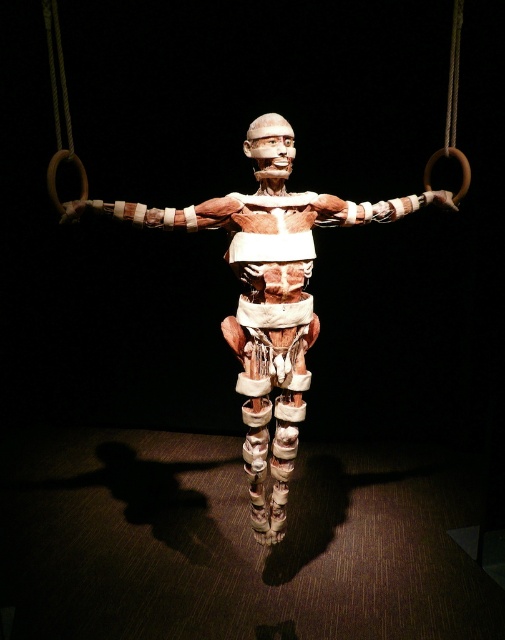
Is matte brown anatomical model at center smaller than wooden rings at upper center?

No.

Which is in front, point (270, 348) or point (453, 140)?

Point (270, 348) is more forward.

Find the location of `matte brown anatomical model at center`. matte brown anatomical model at center is located at coordinates (269, 292).